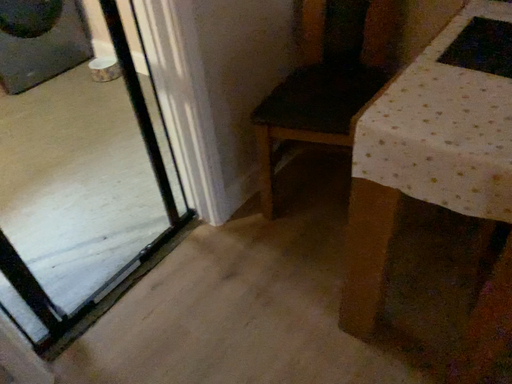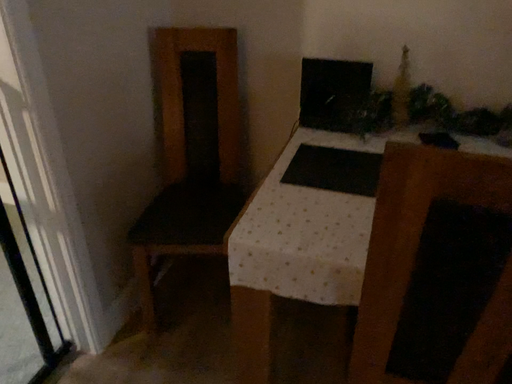
Question: Which way did the camera rotate in the video?

Choices:
 (A) rotated downward
 (B) rotated upward

Answer: (B)